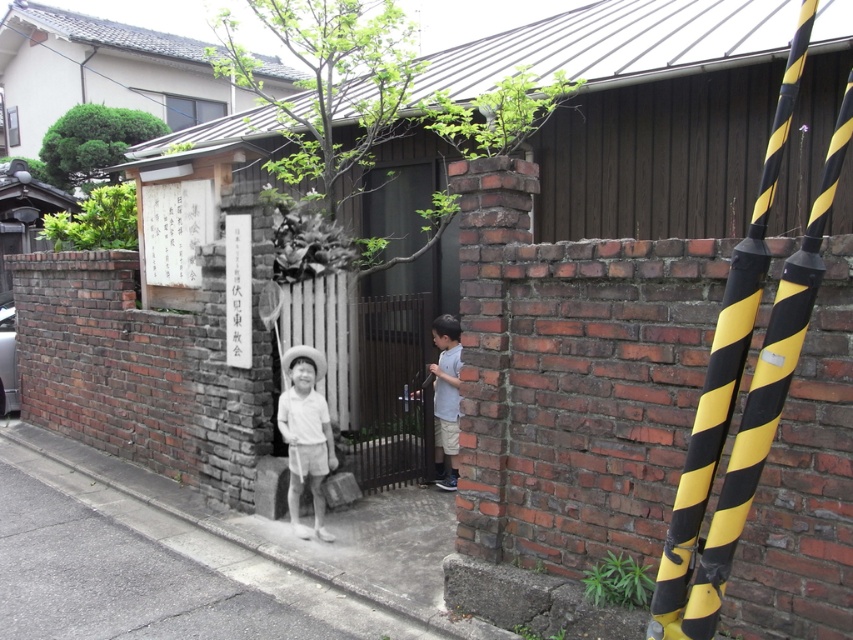
You are standing in front of the residential area with a brick wall and a wooden gate. There are two children nearby. Where is the green leafy tree located relative to the point marked as coordinates point (370, 93)?

The green leafy tree at upper center is located exactly at the coordinates point (370, 93).